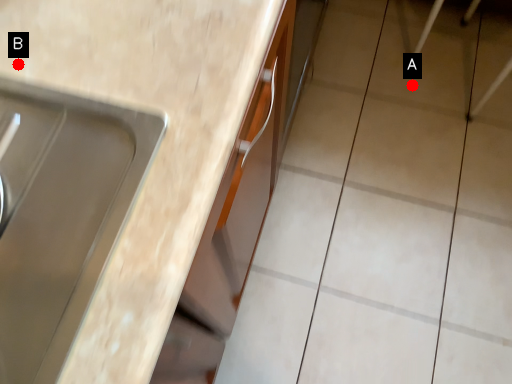
Question: Two points are circled on the image, labeled by A and B beside each circle. Which point is farther from the camera taking this photo?

Choices:
 (A) A is further
 (B) B is further

Answer: (A)